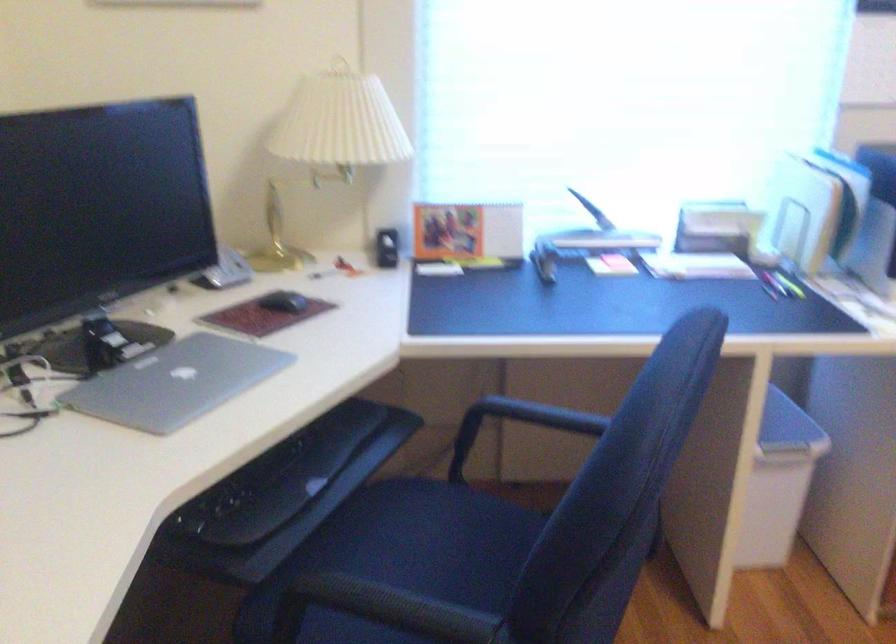
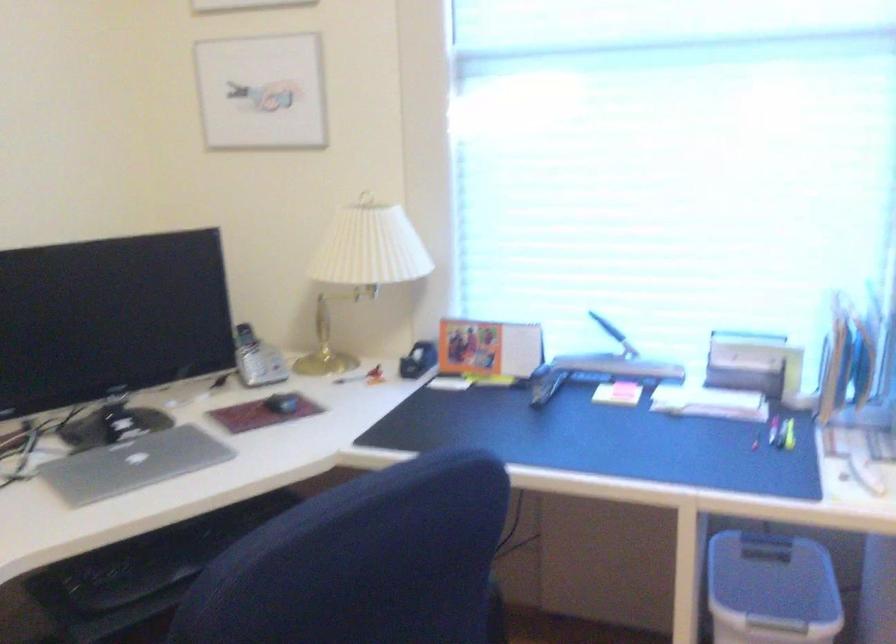
The point at (291, 301) is marked in the first image. Where is the corresponding point in the second image?

(281, 402)